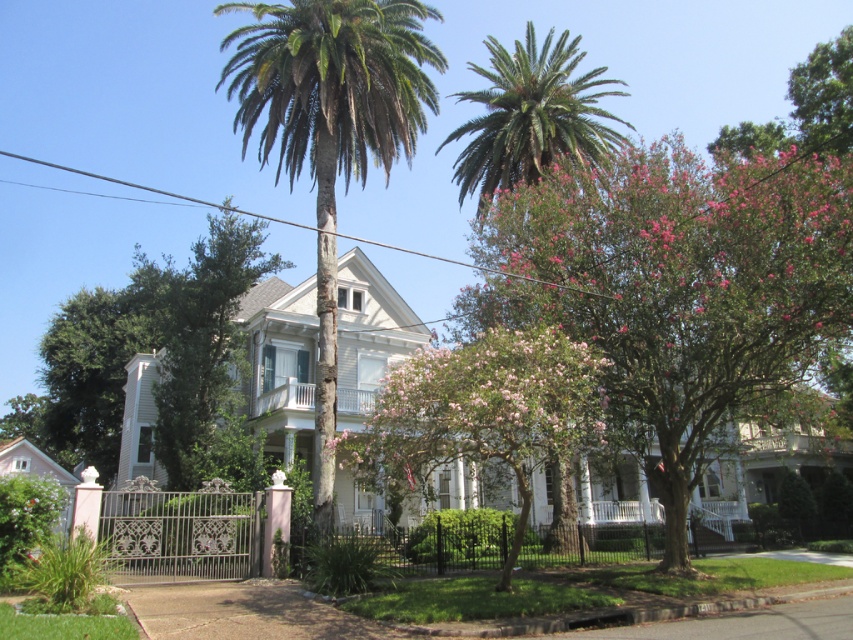
Question: Estimate the real-world distances between objects in this image. Which object is farther from the pink bloom tree at center?

Choices:
 (A) green textured palm tree at center
 (B) pink leafy tree at upper right

Answer: (A)

Question: Can you confirm if pink leafy tree at upper right is wider than green textured palm tree at center?

Choices:
 (A) yes
 (B) no

Answer: (B)

Question: Which point appears farthest from the camera in this image?

Choices:
 (A) (503, 164)
 (B) (843, 285)

Answer: (A)

Question: Which object appears closest to the camera in this image?

Choices:
 (A) pink bloom tree at center
 (B) green leafy palm tree at upper center
 (C) green textured palm tree at center

Answer: (A)

Question: Can you confirm if pink leafy tree at upper right is positioned to the left of green textured palm tree at center?

Choices:
 (A) yes
 (B) no

Answer: (B)

Question: Is green textured palm tree at center in front of pink bloom tree at center?

Choices:
 (A) yes
 (B) no

Answer: (B)